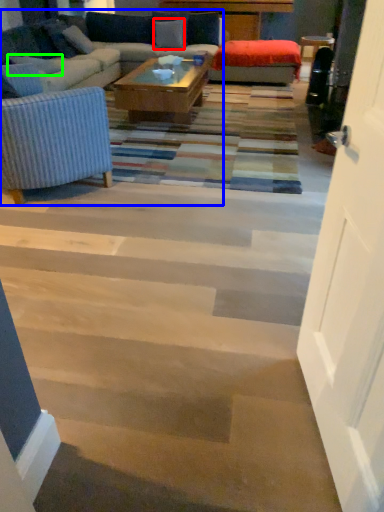
Question: Based on their relative distances, which object is nearer to pillow (highlighted by a red box)? Choose from studio couch (highlighted by a blue box) and pillow (highlighted by a green box).

Choices:
 (A) studio couch
 (B) pillow

Answer: (A)